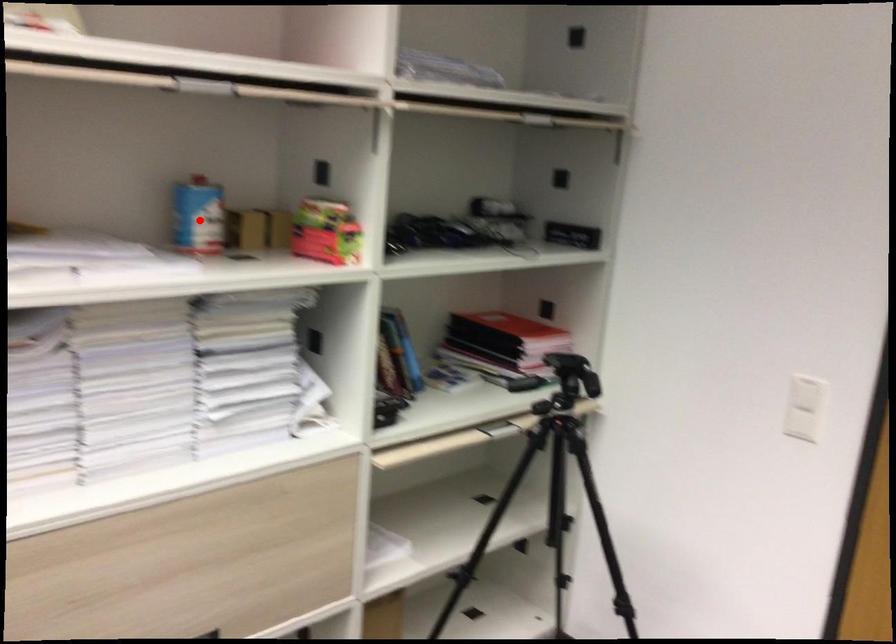
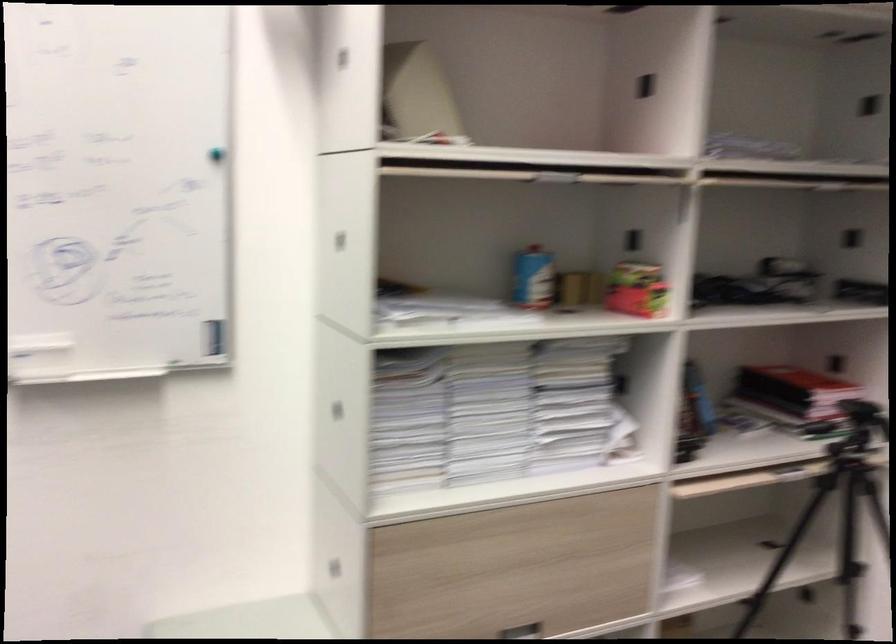
Find the pixel in the second image that matches the highlighted location in the first image.

(532, 278)